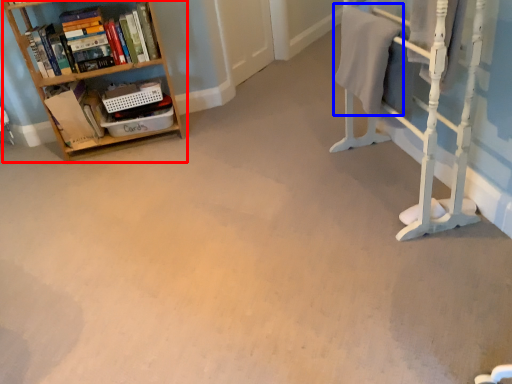
Question: Which of the following is the farthest to the observer, shelf (highlighted by a red box) or bath towel (highlighted by a blue box)?

Choices:
 (A) shelf
 (B) bath towel

Answer: (A)